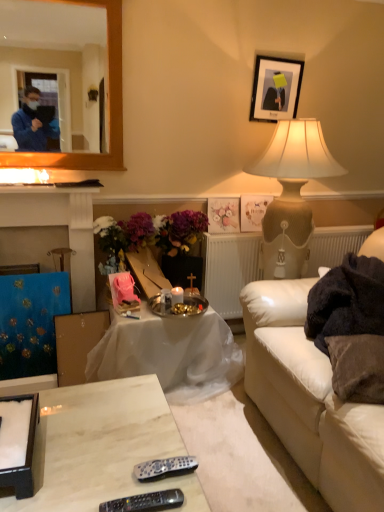
Describe the element at coordinates (104, 446) in the screenshot. I see `marble remote control at lower center, the first table when ordered from front to back` at that location.

This screenshot has width=384, height=512. Find the location of `silver metallic remote at lower center, the 1th remote viewed from the back`. silver metallic remote at lower center, the 1th remote viewed from the back is located at coordinates (164, 468).

What do you see at coordinates (145, 502) in the screenshot? This screenshot has width=384, height=512. I see `black plastic remote at lower center, the 1th remote viewed from the front` at bounding box center [145, 502].

Describe the element at coordinates (52, 234) in the screenshot. I see `blue painted wood fireplace at left` at that location.

What is the approximate width of matte black picture frame at upper center, which is counted as the 3th picture frame, starting from the bottom?

3.23 centimeters.

Image resolution: width=384 pixels, height=512 pixels. What do you see at coordinates (275, 88) in the screenshot?
I see `matte black picture frame at upper center, which is counted as the 3th picture frame, starting from the bottom` at bounding box center [275, 88].

This screenshot has width=384, height=512. Find the location of `marble remote control at lower center, the 2th table from the back`. marble remote control at lower center, the 2th table from the back is located at coordinates (104, 446).

Does blue fabric curtain at left have a greater width compared to white leather couch at lower right?

Incorrect, the width of blue fabric curtain at left does not surpass that of white leather couch at lower right.

Can we say blue fabric curtain at left lies outside white leather couch at lower right?

blue fabric curtain at left is positioned outside white leather couch at lower right.

Does blue fabric curtain at left touch white leather couch at lower right?

No, blue fabric curtain at left is not in contact with white leather couch at lower right.

Considering the positions of objects blue fabric curtain at left and white leather couch at lower right in the image provided, who is more to the right, blue fabric curtain at left or white leather couch at lower right?

white leather couch at lower right.

Which object is wider, white cloth-covered table at center, marked as the second table in a front-to-back arrangement, or marble remote control at lower center, the first table when ordered from front to back?

marble remote control at lower center, the first table when ordered from front to back, is wider.

In the image, is white cloth-covered table at center, marked as the first table in a back-to-front arrangement, positioned in front of or behind marble remote control at lower center, the first table when ordered from front to back?

white cloth-covered table at center, marked as the first table in a back-to-front arrangement, is behind marble remote control at lower center, the first table when ordered from front to back.

Is white cloth-covered table at center, marked as the first table in a back-to-front arrangement, positioned far away from marble remote control at lower center, the first table when ordered from front to back?

No.

Based on the photo, from a real-world perspective, which object stands above the other?

From a 3D spatial view, white cloth-covered table at center, marked as the first table in a back-to-front arrangement, is above.

Considering the points (281, 58) and (223, 249), which point is behind, point (281, 58) or point (223, 249)?

The point (223, 249) is more distant.

Is matte black picture frame at upper center, which is counted as the 3th picture frame, starting from the bottom, wider or thinner than white textured radiator at center?

Clearly, matte black picture frame at upper center, which is counted as the 3th picture frame, starting from the bottom, has less width compared to white textured radiator at center.

Which is in front, matte black picture frame at upper center, which is counted as the 3th picture frame, starting from the bottom, or white textured radiator at center?

matte black picture frame at upper center, which is counted as the 3th picture frame, starting from the bottom.

In terms of height, does matte black picture frame at upper center, placed as the 1th picture frame when sorted from top to bottom, look taller or shorter compared to white textured radiator at center?

Considering their sizes, matte black picture frame at upper center, placed as the 1th picture frame when sorted from top to bottom, has less height than white textured radiator at center.

Does white paper picture frame at upper center, the second picture frame in the bottom-to-top sequence, have a greater height compared to matte floral picture frame at center, acting as the third picture frame starting from the top?

Yes.

Is white paper picture frame at upper center, acting as the 2th picture frame starting from the top, at the left side of matte floral picture frame at center, marked as the 1th picture frame in a bottom-to-top arrangement?

Incorrect, white paper picture frame at upper center, acting as the 2th picture frame starting from the top, is not on the left side of matte floral picture frame at center, marked as the 1th picture frame in a bottom-to-top arrangement.

Where is `picture frame on the left of the white paper picture frame at upper center, acting as the 2th picture frame starting from the top`? Image resolution: width=384 pixels, height=512 pixels. picture frame on the left of the white paper picture frame at upper center, acting as the 2th picture frame starting from the top is located at coordinates (223, 215).

From the image's perspective, which is below, white paper picture frame at upper center, acting as the 2th picture frame starting from the top, or matte floral picture frame at center, acting as the third picture frame starting from the top?

matte floral picture frame at center, acting as the third picture frame starting from the top, from the image's perspective.

Would you say marble remote control at lower center, the first table when ordered from front to back, is inside or outside blue fabric curtain at left?

marble remote control at lower center, the first table when ordered from front to back, cannot be found inside blue fabric curtain at left.

Identify the location of the 1st table counting from the right side of the blue fabric curtain at left. (104, 446).

Considering the sizes of objects marble remote control at lower center, the 2th table from the back, and blue fabric curtain at left in the image provided, who is smaller, marble remote control at lower center, the 2th table from the back, or blue fabric curtain at left?

With smaller size is blue fabric curtain at left.

Are marble remote control at lower center, the first table when ordered from front to back, and blue fabric curtain at left located far from each other?

No, marble remote control at lower center, the first table when ordered from front to back, is not far away from blue fabric curtain at left.

Considering the positions of point (305, 393) and point (23, 248), is point (305, 393) closer or farther from the camera than point (23, 248)?

Clearly, point (305, 393) is closer to the camera than point (23, 248).

Locate an element on the screen. This screenshot has width=384, height=512. fireplace that is on the left side of white leather couch at lower right is located at coordinates (52, 234).

Can you confirm if white leather couch at lower right is shorter than blue painted wood fireplace at left?

Indeed, white leather couch at lower right has a lesser height compared to blue painted wood fireplace at left.

From the picture: Between marble remote control at lower center, the 2th table from the back, and white textured radiator at center, which one has smaller size?

Smaller between the two is white textured radiator at center.

Considering the sizes of objects marble remote control at lower center, the first table when ordered from front to back, and white textured radiator at center in the image provided, who is thinner, marble remote control at lower center, the first table when ordered from front to back, or white textured radiator at center?

white textured radiator at center.

This screenshot has height=512, width=384. What are the coordinates of `radiator located above the marble remote control at lower center, the first table when ordered from front to back (from a real-world perspective)` in the screenshot? It's located at (231, 269).

Is marble remote control at lower center, the first table when ordered from front to back, directly adjacent to white textured radiator at center?

No.

The image size is (384, 512). In the image, there is a blue fabric curtain at left. What are the coordinates of `studio couch below it (from the image's perspective)` in the screenshot? It's located at (310, 399).

Where is `table that is on the left side of white cloth-covered table at center, marked as the first table in a back-to-front arrangement`? table that is on the left side of white cloth-covered table at center, marked as the first table in a back-to-front arrangement is located at coordinates (104, 446).

Considering their positions, is matte black picture frame at upper center, which is counted as the 3th picture frame, starting from the bottom, positioned closer to marble remote control at lower center, the first table when ordered from front to back, than blue painted wood fireplace at left?

blue painted wood fireplace at left.

In the scene shown: Based on their spatial positions, is white leather couch at lower right or white textured radiator at center closer to blue fabric curtain at left?

white textured radiator at center is positioned closer to the anchor blue fabric curtain at left.

From the image, which object appears to be farther from white paper picture frame at upper center, the second picture frame in the bottom-to-top sequence, marble remote control at lower center, the first table when ordered from front to back, or silver metallic remote at lower center, which ranks as the second remote in front-to-back order?

Among the two, silver metallic remote at lower center, which ranks as the second remote in front-to-back order, is located further to white paper picture frame at upper center, the second picture frame in the bottom-to-top sequence.

From the image, which object appears to be nearer to silver metallic remote at lower center, which ranks as the second remote in front-to-back order, blue painted wood fireplace at left or brown fuzzy pillow at lower right?

The object closer to silver metallic remote at lower center, which ranks as the second remote in front-to-back order, is brown fuzzy pillow at lower right.

Considering their positions, is white cloth-covered table at center, marked as the first table in a back-to-front arrangement, positioned closer to white paper picture frame at upper center, acting as the 2th picture frame starting from the top, than matte floral picture frame at center, marked as the 1th picture frame in a bottom-to-top arrangement?

matte floral picture frame at center, marked as the 1th picture frame in a bottom-to-top arrangement, is closer to white paper picture frame at upper center, acting as the 2th picture frame starting from the top.

When comparing their distances from matte black picture frame at upper center, which is counted as the 3th picture frame, starting from the bottom, does marble remote control at lower center, the first table when ordered from front to back, or blue painted wood fireplace at left seem closer?

The object closer to matte black picture frame at upper center, which is counted as the 3th picture frame, starting from the bottom, is blue painted wood fireplace at left.

Looking at this image, which object lies nearer to the anchor point white leather couch at lower right, blue fabric curtain at left or silver metallic remote at lower center, which ranks as the second remote in front-to-back order?

Among the two, silver metallic remote at lower center, which ranks as the second remote in front-to-back order, is located nearer to white leather couch at lower right.

When comparing their distances from white cloth-covered table at center, marked as the second table in a front-to-back arrangement, does white leather couch at lower right or matte floral picture frame at center, marked as the 1th picture frame in a bottom-to-top arrangement, seem closer?

Based on the image, white leather couch at lower right appears to be nearer to white cloth-covered table at center, marked as the second table in a front-to-back arrangement.

Identify the location of fireplace located between black plastic remote at lower center, the 1th remote viewed from the front, and matte floral picture frame at center, marked as the 1th picture frame in a bottom-to-top arrangement, in the depth direction. (52, 234).

At what (x,y) coordinates should I click in order to perform the action: click on curtain between marble remote control at lower center, the 2th table from the back, and white paper picture frame at upper center, the second picture frame in the bottom-to-top sequence, along the z-axis. Please return your answer as a coordinate pair (x, y). Image resolution: width=384 pixels, height=512 pixels. Looking at the image, I should click on (31, 322).

I want to click on curtain that lies between matte black picture frame at upper center, placed as the 1th picture frame when sorted from top to bottom, and marble remote control at lower center, the first table when ordered from front to back, from top to bottom, so click(31, 322).

In order to click on studio couch located between marble remote control at lower center, the first table when ordered from front to back, and white paper picture frame at upper center, acting as the 2th picture frame starting from the top, in the depth direction in this screenshot , I will do `click(310, 399)`.